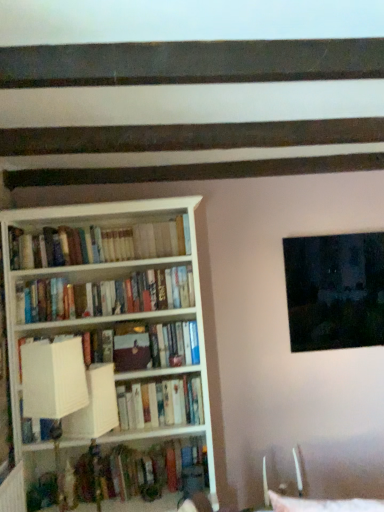
Measure the distance between point (x=54, y=341) and camera.

Point (x=54, y=341) and camera are 8.05 feet apart from each other.

Locate an element on the screen. white fabric lampshade at left is located at coordinates (53, 378).

The height and width of the screenshot is (512, 384). What do you see at coordinates (143, 471) in the screenshot?
I see `wooden book at lower center, marked as the fourth book in a top-to-bottom arrangement` at bounding box center [143, 471].

Locate an element on the screen. The height and width of the screenshot is (512, 384). matte brown book at center is located at coordinates (131, 352).

From a real-world perspective, is metallic silver swivel chair at lower right over dark matte painting at upper right?

Actually, metallic silver swivel chair at lower right is physically below dark matte painting at upper right in the real world.

Is metallic silver swivel chair at lower right inside or outside of dark matte painting at upper right?

metallic silver swivel chair at lower right is outside dark matte painting at upper right.

Based on the photo, is metallic silver swivel chair at lower right not close to dark matte painting at upper right?

No, metallic silver swivel chair at lower right is not far from dark matte painting at upper right.

Considering the relative sizes of metallic silver swivel chair at lower right and dark matte painting at upper right in the image provided, is metallic silver swivel chair at lower right thinner than dark matte painting at upper right?

No, metallic silver swivel chair at lower right is not thinner than dark matte painting at upper right.

Could you tell me if wooden book at lower center, which appears as the first book when ordered from the bottom, is turned towards metallic silver swivel chair at lower right?

No, wooden book at lower center, which appears as the first book when ordered from the bottom, is not aimed at metallic silver swivel chair at lower right.

Between wooden book at lower center, which appears as the first book when ordered from the bottom, and metallic silver swivel chair at lower right, which one has larger size?

wooden book at lower center, which appears as the first book when ordered from the bottom.

Is the surface of wooden book at lower center, marked as the fourth book in a top-to-bottom arrangement, in direct contact with metallic silver swivel chair at lower right?

No, wooden book at lower center, marked as the fourth book in a top-to-bottom arrangement, is not in contact with metallic silver swivel chair at lower right.

Does wooden book at lower center, which appears as the first book when ordered from the bottom, have a lesser width compared to metallic silver swivel chair at lower right?

In fact, wooden book at lower center, which appears as the first book when ordered from the bottom, might be wider than metallic silver swivel chair at lower right.

Could you tell me if white matte bookshelf at upper left, which is the first book in top-to-bottom order, is facing metallic silver swivel chair at lower right?

No, white matte bookshelf at upper left, which is the first book in top-to-bottom order, is not aimed at metallic silver swivel chair at lower right.

Considering the relative positions of white matte bookshelf at upper left, which is the fourth book in bottom-to-top order, and metallic silver swivel chair at lower right in the image provided, is white matte bookshelf at upper left, which is the fourth book in bottom-to-top order, to the right of metallic silver swivel chair at lower right from the viewer's perspective?

No, white matte bookshelf at upper left, which is the fourth book in bottom-to-top order, is not to the right of metallic silver swivel chair at lower right.

Consider the image. How much distance is there between white matte bookshelf at upper left, which is the first book in top-to-bottom order, and metallic silver swivel chair at lower right?

The distance of white matte bookshelf at upper left, which is the first book in top-to-bottom order, from metallic silver swivel chair at lower right is 5.31 feet.

Is white matte bookshelf at upper left, which is the fourth book in bottom-to-top order, completely or partially outside of hardcover books at center, which ranks as the third book in bottom-to-top order?

Yes, white matte bookshelf at upper left, which is the fourth book in bottom-to-top order, is located beyond the bounds of hardcover books at center, which ranks as the third book in bottom-to-top order.

Does point (65, 241) come behind point (135, 293)?

No, it is not.

From a real-world perspective, which object stands above the other?

white matte bookshelf at upper left, which is the fourth book in bottom-to-top order.

Who is more distant, white matte bookshelf at upper left, which is the first book in top-to-bottom order, or hardcover books at center, the second book from the top?

hardcover books at center, the second book from the top, is behind.

How far apart are metallic silver swivel chair at lower right and matte brown book at center?

A: The distance of metallic silver swivel chair at lower right from matte brown book at center is 1.05 meters.

Is metallic silver swivel chair at lower right next to matte brown book at center?

No, metallic silver swivel chair at lower right is not making contact with matte brown book at center.

Which of these two, metallic silver swivel chair at lower right or matte brown book at center, is bigger?

With larger size is metallic silver swivel chair at lower right.

Could you tell me if metallic silver swivel chair at lower right is facing matte brown book at center?

No, metallic silver swivel chair at lower right is not turned towards matte brown book at center.

Choose the correct answer: Is white fabric lampshade at left inside hardcover books at center, which ranks as the third book in bottom-to-top order, or outside it?

white fabric lampshade at left is spatially situated outside hardcover books at center, which ranks as the third book in bottom-to-top order.

Is white fabric lampshade at left at the left side of hardcover books at center, which ranks as the third book in bottom-to-top order?

No, white fabric lampshade at left is not to the left of hardcover books at center, which ranks as the third book in bottom-to-top order.

Is white fabric lampshade at left not close to hardcover books at center, which ranks as the third book in bottom-to-top order?

No.

From the image's perspective, which one is positioned higher, hardcover books at center, the second book from the top, or dark matte painting at upper right?

dark matte painting at upper right appears higher in the image.

Which of these two, hardcover books at center, which ranks as the third book in bottom-to-top order, or dark matte painting at upper right, is smaller?

With smaller size is hardcover books at center, which ranks as the third book in bottom-to-top order.

Measure the distance between hardcover books at center, which ranks as the third book in bottom-to-top order, and dark matte painting at upper right.

hardcover books at center, which ranks as the third book in bottom-to-top order, is 39.04 inches from dark matte painting at upper right.

I want to click on book that is the 1st one when counting downward from the dark matte painting at upper right (from the image's perspective), so click(105, 296).

Locate an element on the screen. window above the metallic silver swivel chair at lower right (from a real-world perspective) is located at coordinates (335, 291).

Identify the location of swivel chair that appears below the wooden book at lower center, marked as the fourth book in a top-to-bottom arrangement (from the image's perspective). This screenshot has height=512, width=384. (298, 469).

When comparing their distances from matte brown book at center, does dark matte painting at upper right or wooden book at lower center, which appears as the first book when ordered from the bottom, seem closer?

wooden book at lower center, which appears as the first book when ordered from the bottom.

Based on their spatial positions, is wooden book at lower center, which appears as the first book when ordered from the bottom, or hardcover books at center, the second book from the top, closer to white matte bookshelf at upper left, which is the first book in top-to-bottom order?

hardcover books at center, the second book from the top, lies closer to white matte bookshelf at upper left, which is the first book in top-to-bottom order, than the other object.

Which object lies nearer to the anchor point dark matte painting at upper right, white cardboard box at center, the second book positioned from the bottom, or matte brown book at center?

matte brown book at center is positioned closer to the anchor dark matte painting at upper right.

Which object lies further to the anchor point white fabric lampshade at left, hardcover books at center, the second book from the top, or metallic silver swivel chair at lower right?

metallic silver swivel chair at lower right is further to white fabric lampshade at left.

Considering their positions, is white cardboard box at center, the second book positioned from the bottom, positioned further to dark matte painting at upper right than white wood bookcase at left?

white cardboard box at center, the second book positioned from the bottom.

Which object lies further to the anchor point white wood bookcase at left, metallic silver swivel chair at lower right or white matte bookshelf at upper left, which is the first book in top-to-bottom order?

Based on the image, metallic silver swivel chair at lower right appears to be further to white wood bookcase at left.

Based on their spatial positions, is dark matte painting at upper right or matte brown book at center further from white matte bookshelf at upper left, which is the first book in top-to-bottom order?

dark matte painting at upper right.

Looking at the image, which one is located closer to white fabric lampshade at left, wooden book at lower center, which appears as the first book when ordered from the bottom, or white wood bookcase at left?

The object closer to white fabric lampshade at left is white wood bookcase at left.

The height and width of the screenshot is (512, 384). In order to click on paperback book that lies between white matte bookshelf at upper left, which is the first book in top-to-bottom order, and wooden book at lower center, which appears as the first book when ordered from the bottom, from top to bottom in this screenshot , I will do `click(131, 352)`.

The width and height of the screenshot is (384, 512). In order to click on paperback book located between white wood bookcase at left and dark matte painting at upper right in the left-right direction in this screenshot , I will do `click(131, 352)`.

You are a GUI agent. You are given a task and a screenshot of the screen. Output one action in this format:
    pyautogui.click(x=<x>, y=<y>)
    Task: Click on the swivel chair situated between white wood bookcase at left and dark matte painting at upper right from left to right
    The image size is (384, 512).
    Given the screenshot: What is the action you would take?
    pyautogui.click(x=298, y=469)

This screenshot has height=512, width=384. Find the location of `table lamp between hardcover books at center, the second book from the top, and metallic silver swivel chair at lower right from left to right`. table lamp between hardcover books at center, the second book from the top, and metallic silver swivel chair at lower right from left to right is located at coordinates (53, 378).